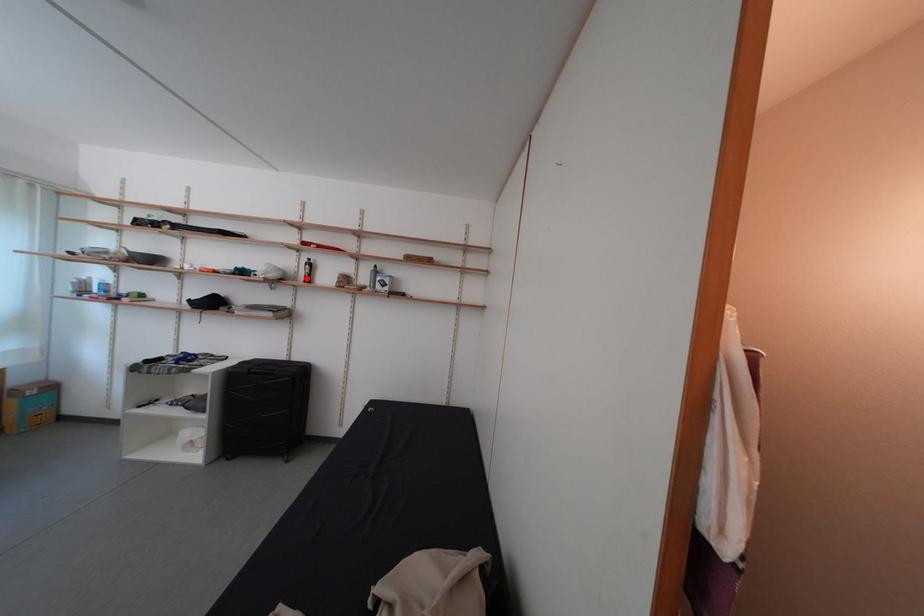
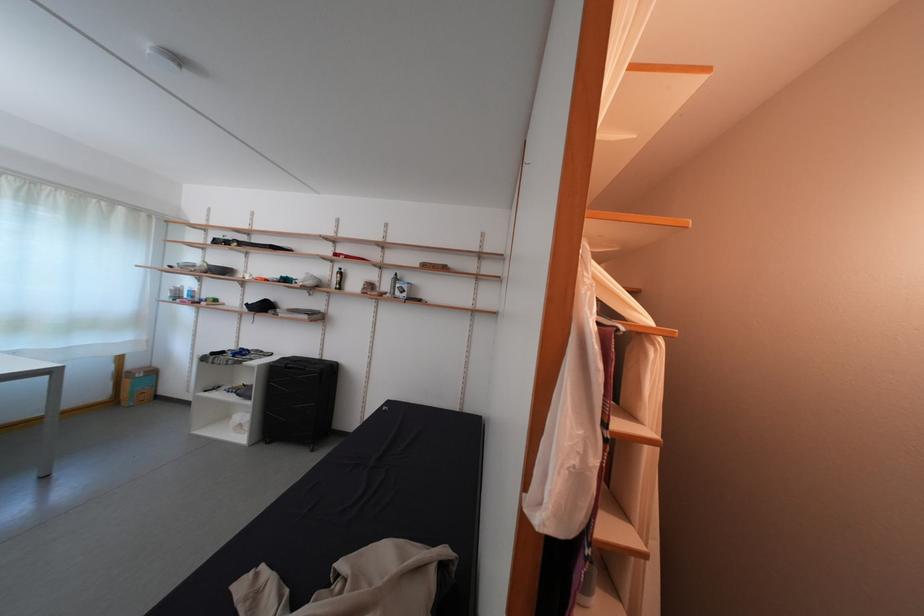
In the second image, find the point that corresponds to the highlighted location in the first image.

(339, 286)